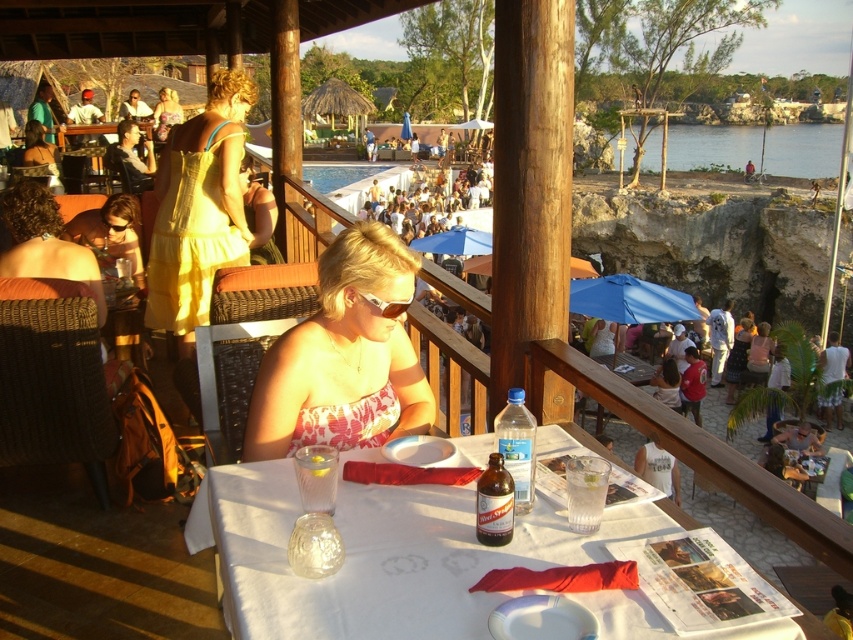
You are standing at the edge of the wooden deck and want to throw a frisbee to a friend who is at the blue water at lower right. The frisbee can travel up to 90 feet. Will you be able to reach your friend?

The blue water at lower right is 92.65 feet away from the camera. Since the frisbee can only travel up to 90 feet, you will not be able to reach your friend.

You are a guest at this outdoor dining area and want to reach the blue water at lower right without walking through the blue fabric umbrella at center. Is there a way to do this?

The blue fabric umbrella at center is behind blue water at lower right, so you can go around the blue water at lower right to avoid walking through the umbrella.